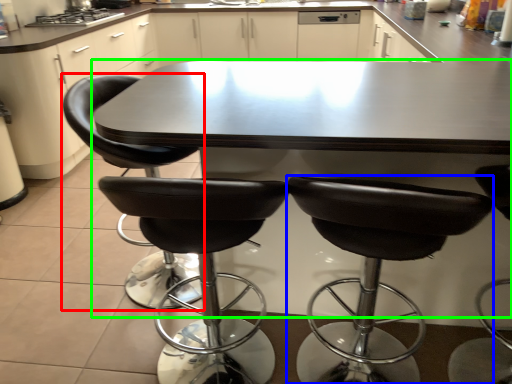
Question: Which object is positioned closest to chair (highlighted by a red box)? Select from chair (highlighted by a blue box) and table (highlighted by a green box).

Choices:
 (A) chair
 (B) table

Answer: (B)